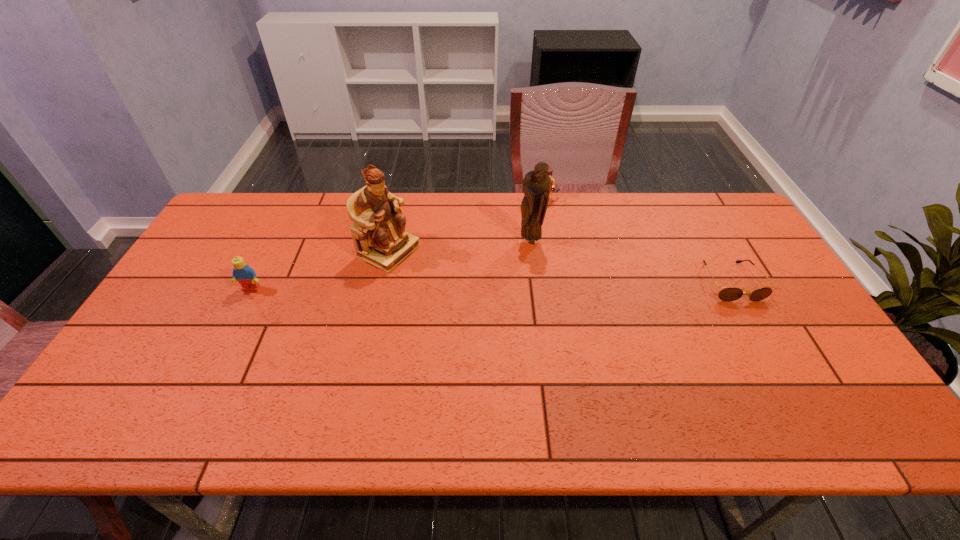
The width and height of the screenshot is (960, 540). Find the location of `vacant region located on the front-facing side of the left figurine`. vacant region located on the front-facing side of the left figurine is located at coordinates (511, 314).

Locate an element on the screen. The width and height of the screenshot is (960, 540). free space located 0.130m on the front-facing side of the left figurine is located at coordinates (446, 281).

You are a GUI agent. You are given a task and a screenshot of the screen. Output one action in this format:
    pyautogui.click(x=<x>, y=<y>)
    Task: Click on the vacant space located 0.180m on the front-facing side of the left figurine
    
    Given the screenshot: What is the action you would take?
    pyautogui.click(x=461, y=288)

The height and width of the screenshot is (540, 960). I want to click on free space located 0.160m on the front-facing side of the right figurine, so click(x=511, y=281).

The height and width of the screenshot is (540, 960). Find the location of `blank space located on the front-facing side of the right figurine`. blank space located on the front-facing side of the right figurine is located at coordinates (496, 310).

This screenshot has width=960, height=540. I want to click on free space located 0.200m on the front-facing side of the right figurine, so click(x=506, y=291).

The height and width of the screenshot is (540, 960). Identify the location of free space located holding a crossbow in the hands of the right Lego. (520, 240).

You are a GUI agent. You are given a task and a screenshot of the screen. Output one action in this format:
    pyautogui.click(x=<x>, y=<y>)
    Task: Click on the vacant region located 0.100m holding a crossbow in the hands of the right Lego
    The height and width of the screenshot is (540, 960).
    Given the screenshot: What is the action you would take?
    pos(528,224)

Locate an element on the screen. This screenshot has height=540, width=960. vacant space located 0.190m holding a crossbow in the hands of the right Lego is located at coordinates (520, 240).

This screenshot has height=540, width=960. I want to click on figurine located at the far edge, so click(x=378, y=232).